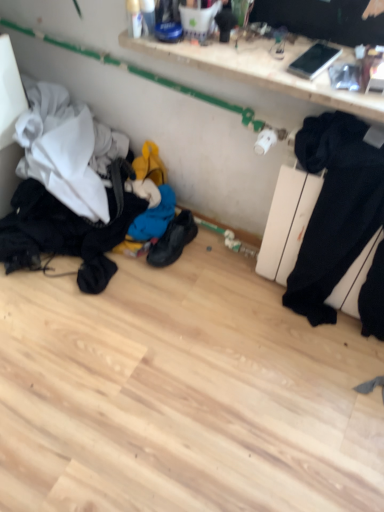
Find the location of a particular element. The height and width of the screenshot is (512, 384). free space in front of black fabric laundry at lower left is located at coordinates (100, 362).